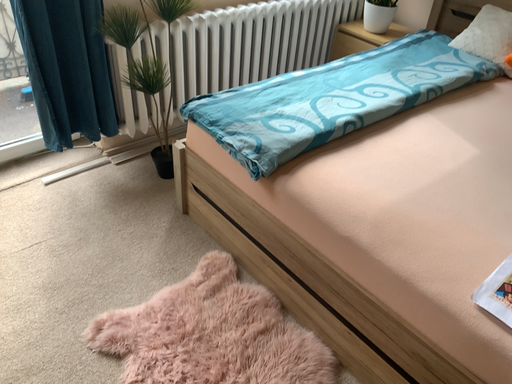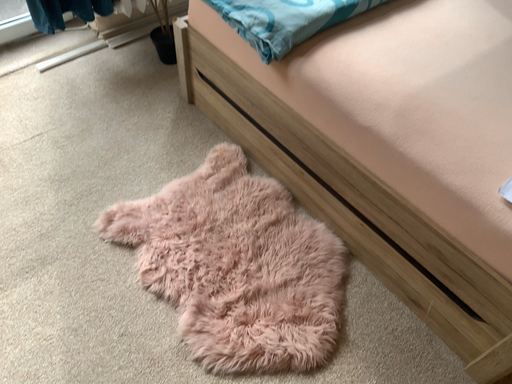
Question: Which way did the camera rotate in the video?

Choices:
 (A) rotated upward
 (B) rotated downward

Answer: (B)